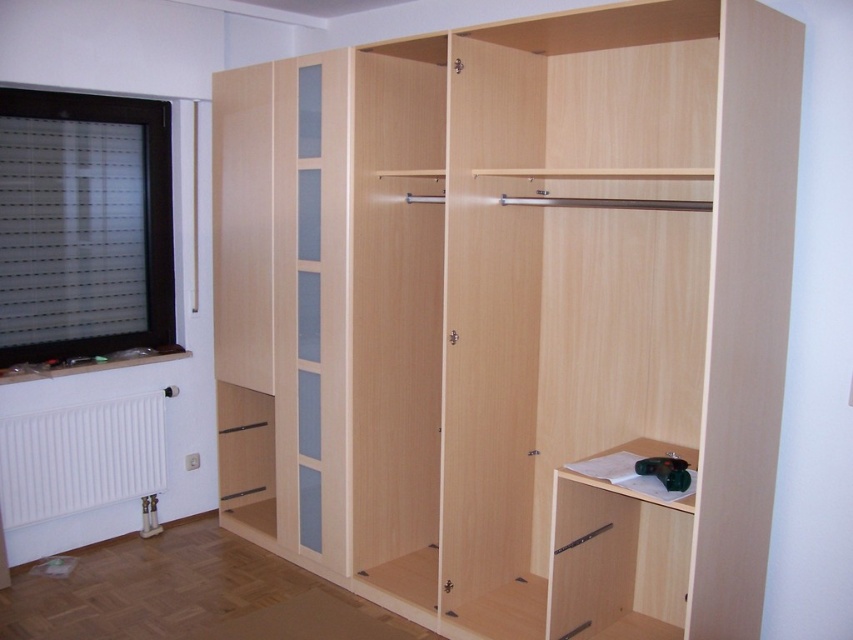
Question: Does light wood closet at center have a smaller size compared to white matte radiator at lower left?

Choices:
 (A) yes
 (B) no

Answer: (B)

Question: Does light wood closet at center appear on the left side of white matte radiator at lower left?

Choices:
 (A) yes
 (B) no

Answer: (B)

Question: Is light wood closet at center bigger than white matte radiator at lower left?

Choices:
 (A) yes
 (B) no

Answer: (A)

Question: Which of the following is the closest to the observer?

Choices:
 (A) (57, 438)
 (B) (759, 246)

Answer: (B)

Question: Which of the following is the farthest from the observer?

Choices:
 (A) (618, 362)
 (B) (142, 464)

Answer: (B)

Question: Which point is farther to the camera?

Choices:
 (A) white matte radiator at lower left
 (B) light wood closet at center

Answer: (A)